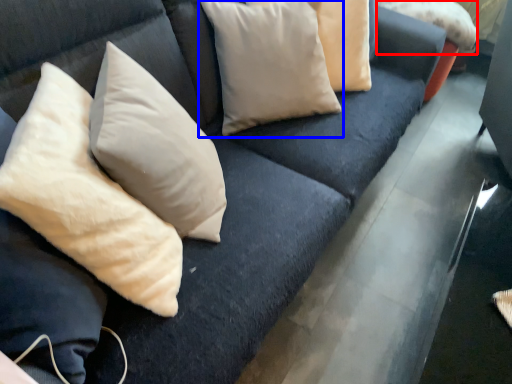
Question: Which of the following is the farthest to the observer, pillow (highlighted by a red box) or pillow (highlighted by a blue box)?

Choices:
 (A) pillow
 (B) pillow

Answer: (A)